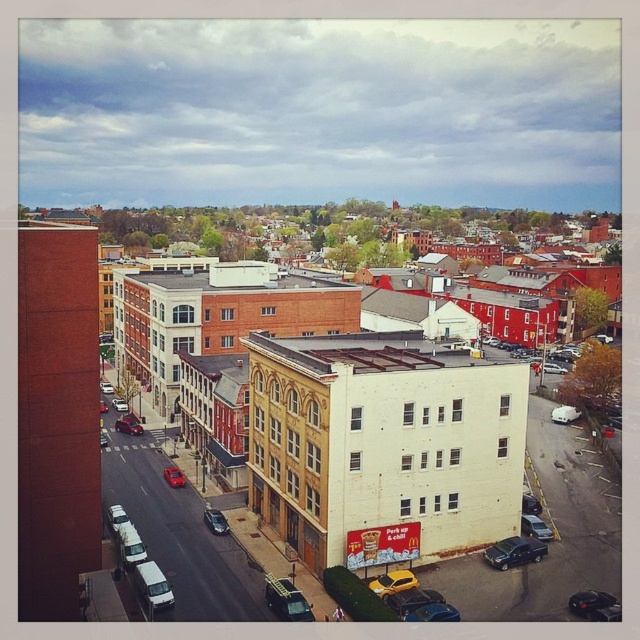
Question: Considering the relative positions of metallic silver sedan at center-right and red matte sedan at center in the image provided, where is metallic silver sedan at center-right located with respect to red matte sedan at center?

Choices:
 (A) left
 (B) right

Answer: (A)

Question: Where is shiny black sedan at lower right located in relation to shiny red car at center-left in the image?

Choices:
 (A) left
 (B) right

Answer: (B)

Question: Which object is the closest to the white matte van at lower left?

Choices:
 (A) shiny silver sedan at center
 (B) satin black sedan at lower right
 (C) shiny red car at center-left
 (D) metallic blue sedan at lower center

Answer: (A)

Question: Estimate the real-world distances between objects in this image. Which object is farther from the white matte car at center-right?

Choices:
 (A) yellow matte car at lower center
 (B) white brick building at center

Answer: (B)

Question: Is shiny black sedan at lower right positioned before shiny silver sedan at center?

Choices:
 (A) yes
 (B) no

Answer: (A)

Question: Which of the following is the closest to the observer?

Choices:
 (A) shiny red sedan at center
 (B) red matte car at center-left
 (C) yellow matte car at lower center

Answer: (C)